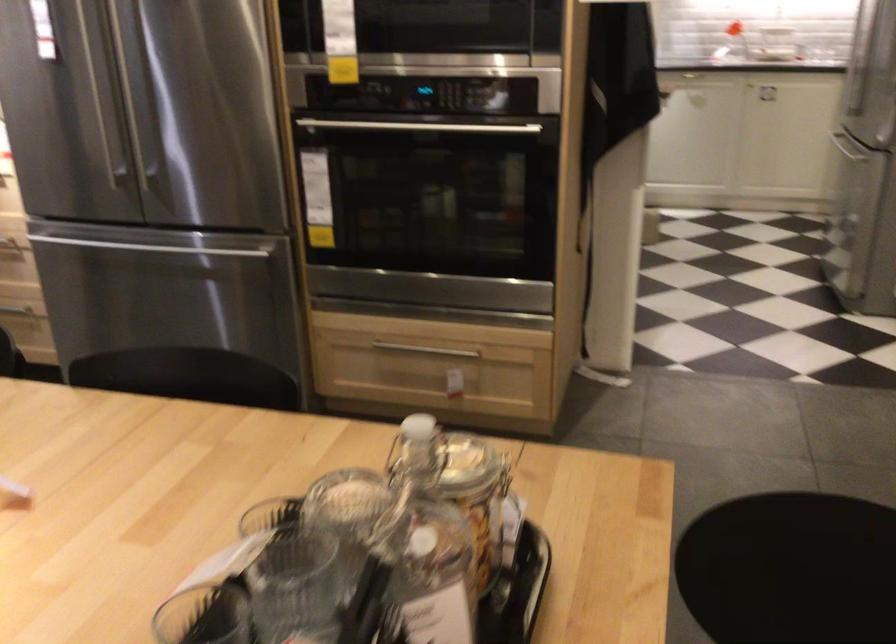
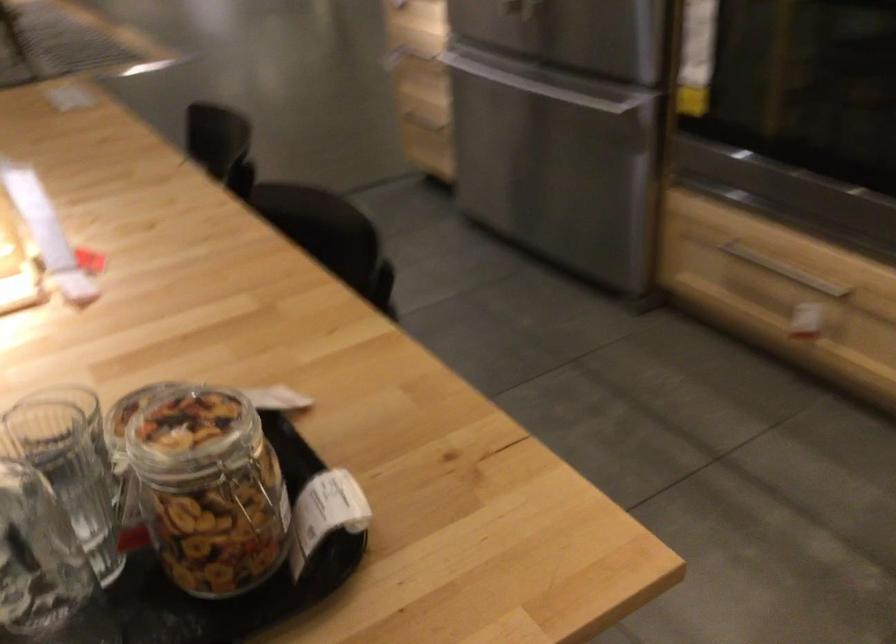
Looking at this image, how did the camera likely rotate?

The camera's rotation is toward left-down.